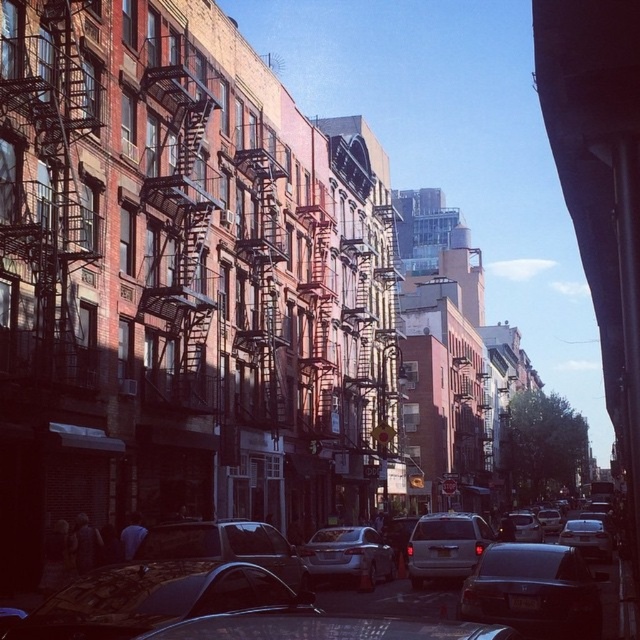
Question: Is satin silver sedan at lower right to the right of metallic silver sedan at center from the viewer's perspective?

Choices:
 (A) yes
 (B) no

Answer: (A)

Question: Which is farther from the satin silver sedan at lower right?

Choices:
 (A) shiny black car at lower left
 (B) satin silver sedan at center

Answer: (A)

Question: Does shiny black sedan at center appear on the right side of satin silver sedan at lower right?

Choices:
 (A) yes
 (B) no

Answer: (B)

Question: Does satin silver suv at center lie behind satin silver sedan at center?

Choices:
 (A) no
 (B) yes

Answer: (B)

Question: Which of the following is the closest to the observer?

Choices:
 (A) (445, 547)
 (B) (305, 548)

Answer: (A)

Question: Which of the following is the closest to the observer?

Choices:
 (A) satin silver sedan at lower right
 (B) satin silver suv at center
 (C) shiny silver sedan at center

Answer: (C)